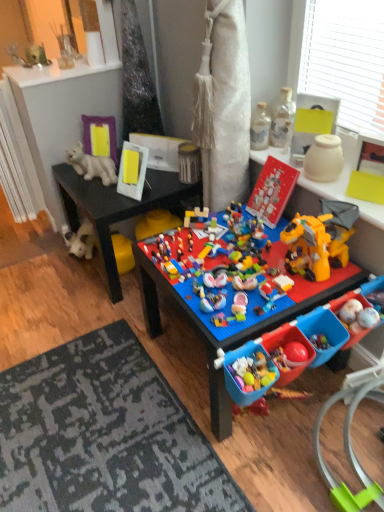
Locate an element on the screen. vacant space situated on the left part of blue plastic table at center is located at coordinates (107, 374).